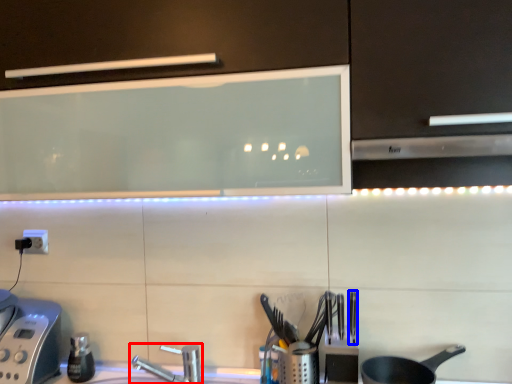
Question: Which object is further to the camera taking this photo, tap (highlighted by a red box) or silverware (highlighted by a blue box)?

Choices:
 (A) tap
 (B) silverware

Answer: (A)